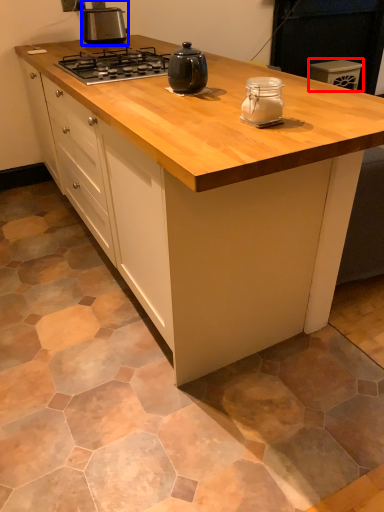
Question: Among these objects, which one is nearest to the camera, appliance (highlighted by a red box) or kitchen appliance (highlighted by a blue box)?

Choices:
 (A) appliance
 (B) kitchen appliance

Answer: (B)